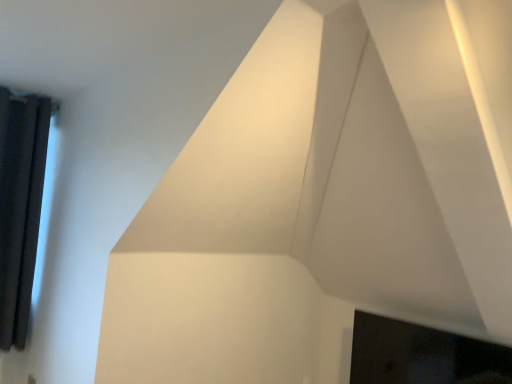
Question: From a real-world perspective, is black curtain at left physically above black glossy fireplace at lower right?

Choices:
 (A) no
 (B) yes

Answer: (B)

Question: Is there a large distance between black curtain at left and black glossy fireplace at lower right?

Choices:
 (A) yes
 (B) no

Answer: (A)

Question: Is black curtain at left wider than black glossy fireplace at lower right?

Choices:
 (A) no
 (B) yes

Answer: (A)

Question: Is black curtain at left closer to camera compared to black glossy fireplace at lower right?

Choices:
 (A) yes
 (B) no

Answer: (B)

Question: Can you confirm if black curtain at left is smaller than black glossy fireplace at lower right?

Choices:
 (A) no
 (B) yes

Answer: (B)

Question: From a real-world perspective, is black curtain at left beneath black glossy fireplace at lower right?

Choices:
 (A) no
 (B) yes

Answer: (A)

Question: Is black glossy fireplace at lower right positioned in front of black curtain at left?

Choices:
 (A) no
 (B) yes

Answer: (B)

Question: Can you confirm if black glossy fireplace at lower right is positioned to the left of black curtain at left?

Choices:
 (A) no
 (B) yes

Answer: (A)

Question: Is black glossy fireplace at lower right further to the viewer compared to black curtain at left?

Choices:
 (A) yes
 (B) no

Answer: (B)

Question: Can you confirm if black glossy fireplace at lower right is taller than black curtain at left?

Choices:
 (A) yes
 (B) no

Answer: (B)

Question: From the image's perspective, would you say black glossy fireplace at lower right is shown under black curtain at left?

Choices:
 (A) no
 (B) yes

Answer: (B)

Question: Is black glossy fireplace at lower right positioned with its back to black curtain at left?

Choices:
 (A) yes
 (B) no

Answer: (B)

Question: Does point (431, 364) appear closer or farther from the camera than point (18, 218)?

Choices:
 (A) farther
 (B) closer

Answer: (B)